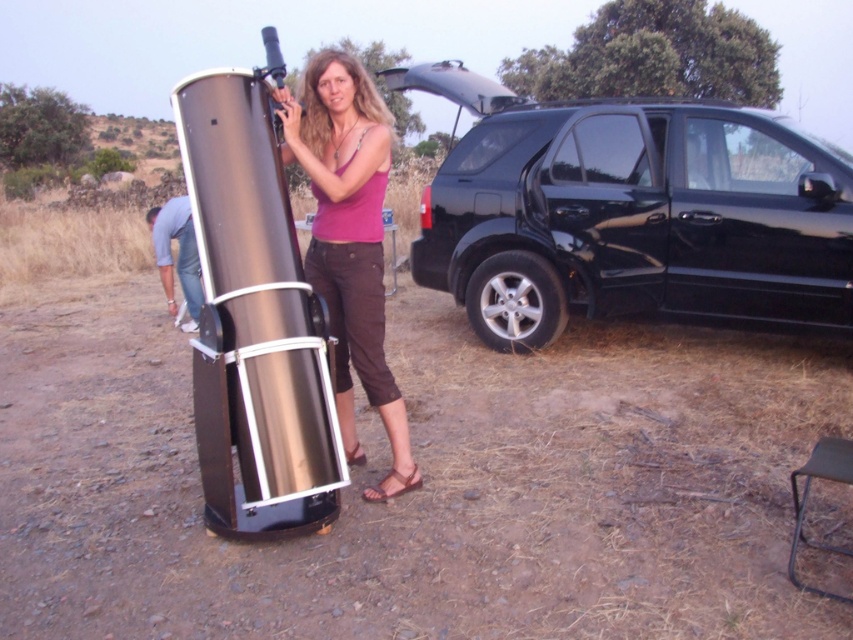
You are a photographer trying to capture the black glossy suv at right and the matte pink tank top at center in a single shot. Based on their positions, which object will appear larger in the photo?

The black glossy suv at right is above matte pink tank top at center, so it will appear larger in the photo because objects higher in the frame tend to be perceived as larger.

You are a delivery person who needs to park your vehicle next to the black glossy suv at right and the brushed metal shoe at lower left. Which one has more space available for parking next to it?

The black glossy suv at right has a greater width than the brushed metal shoe at lower left, so there is more space available next to the black glossy suv at right for parking.

You are a delivery person who needs to place a package on the black glossy suv at right. You are currently standing at the location of the brushed metal shoe at lower left. Can you reach the suv without moving more than 3 meters?

The distance between the black glossy suv at right and the brushed metal shoe at lower left is 3.47 meters, which is more than 3 meters. Therefore, you cannot reach the suv without moving more than 3 meters.